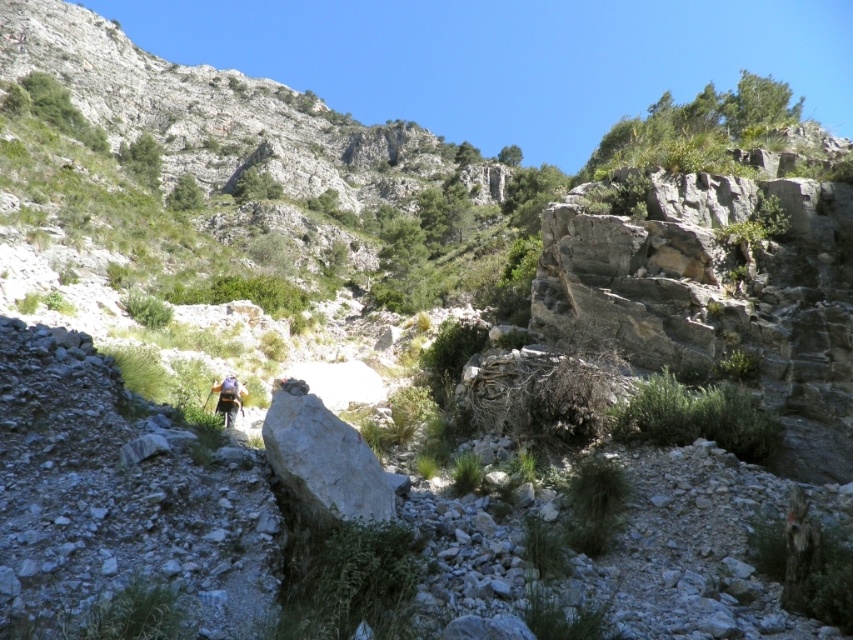
You are a hiker carrying a light blue fabric backpack at center and you see a white smooth rock at center. If you want to place the backpack closer to the rock, should you move forward or backward?

The white smooth rock at center is 8.00 meters away from the light blue fabric backpack at center. To place the backpack closer to the rock, you should move forward towards the rock.

You are a hiker trying to navigate the rocky path. You see a white smooth rock at center and a light blue fabric backpack at center. Which object is taller?

The white smooth rock at center is taller than the light blue fabric backpack at center.